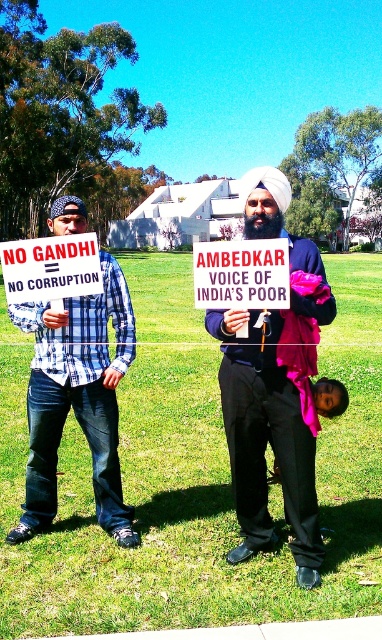
Is white paper sign at center bigger than pink fabric at lower center?

Indeed, white paper sign at center has a larger size compared to pink fabric at lower center.

Which is more to the right, white paper sign at center or pink fabric at lower center?

pink fabric at lower center

Describe the element at coordinates (51, 268) in the screenshot. I see `white paper sign at center` at that location.

The image size is (382, 640). I want to click on white paper sign at center, so click(x=51, y=268).

Can you confirm if dark blue fabric turban at center is taller than pink fabric at lower center?

Indeed, dark blue fabric turban at center has a greater height compared to pink fabric at lower center.

Who is positioned more to the right, dark blue fabric turban at center or pink fabric at lower center?

Positioned to the right is pink fabric at lower center.

Is point (312, 291) more distant than point (323, 397)?

No, it is in front of (323, 397).

You are a GUI agent. You are given a task and a screenshot of the screen. Output one action in this format:
    pyautogui.click(x=<x>, y=<y>)
    Task: Click on the dark blue fabric turban at center
    
    Given the screenshot: What is the action you would take?
    pyautogui.click(x=275, y=387)

Which of these two, cardboard sign at center or pink fabric at lower center, stands taller?

cardboard sign at center is taller.

Can you confirm if cardboard sign at center is positioned above pink fabric at lower center?

Correct, cardboard sign at center is located above pink fabric at lower center.

Does point (226, 243) lie in front of point (315, 397)?

Yes, point (226, 243) is in front of point (315, 397).

Where is `cardboard sign at center`? The height and width of the screenshot is (640, 382). cardboard sign at center is located at coordinates (242, 275).